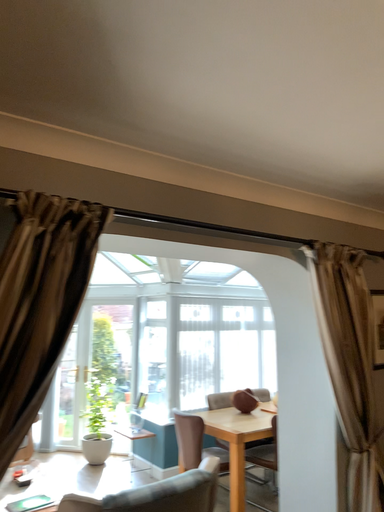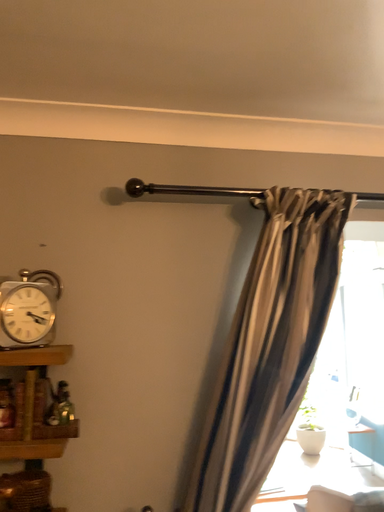
Question: Which way did the camera rotate in the video?

Choices:
 (A) rotated right
 (B) rotated left

Answer: (B)